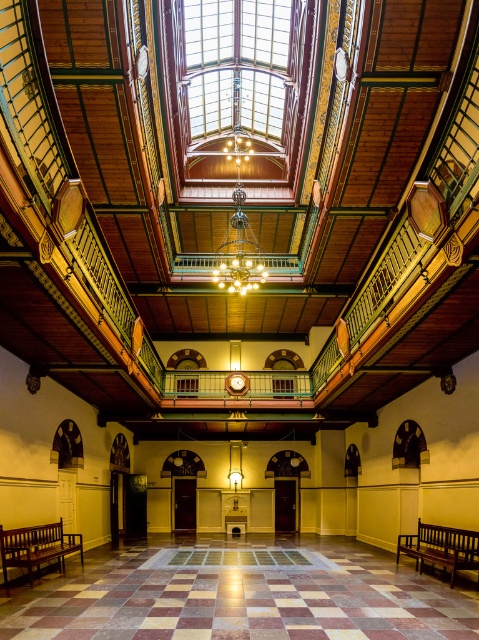
You are standing at the entrance of the grand building and want to walk directly towards the marble tile floor at center. Based on the coordinates provided, in which direction should you head relative to your current position?

The marble tile floor at center is located at coordinates point (239, 595). Since the x coordinate is 0.930, which is closer to 1, you should head to the right to reach it.

You are standing at the entrance of this grand building and want to sit down. You see the marble tile floor at center and the wooden bench at lower left. Which one is higher from the ground?

The marble tile floor at center is higher than the wooden bench at lower left.

Looking at this image, you are planning to place a new rectangular rug in the center of this grand building. The rug must cover the entire marble tile floor at center without overlapping the dark brown wooden bench at lower right. Given their sizes, is this possible?

The marble tile floor at center is larger in size than the dark brown wooden bench at lower right. Therefore, placing a rug that covers the entire marble tile floor at center would necessarily overlap the bench, making it impossible to place the rug without overlapping.